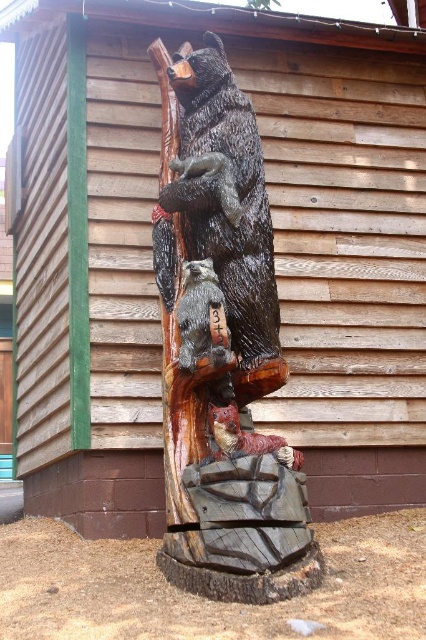
Question: In this image, where is carved wood bear at center located relative to carved wood raccoon at center?

Choices:
 (A) left
 (B) right

Answer: (B)

Question: Can you confirm if carved wood bear at center is thinner than carved wood raccoon at center?

Choices:
 (A) yes
 (B) no

Answer: (B)

Question: Does carved wood bear at center have a smaller size compared to carved wood raccoon at center?

Choices:
 (A) yes
 (B) no

Answer: (B)

Question: Among these objects, which one is farthest from the camera?

Choices:
 (A) carved wood raccoon at center
 (B) carved wood bear at center

Answer: (A)

Question: Which point is closer to the camera?

Choices:
 (A) (255, 506)
 (B) (181, 314)

Answer: (A)